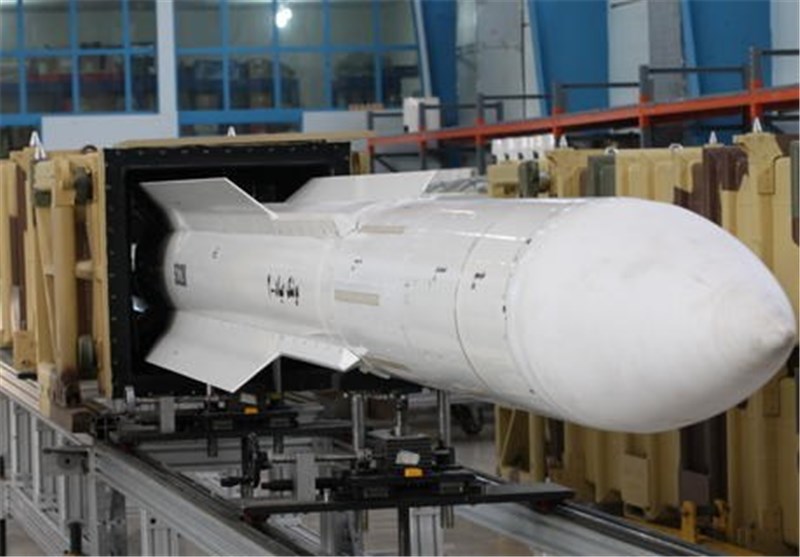
Identify the location of window. (304, 66), (86, 72).